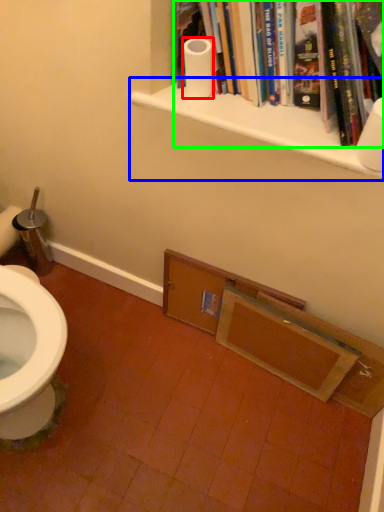
Question: Which object is positioned farthest from toilet paper (highlighted by a red box)? Select from shelf (highlighted by a blue box) and book (highlighted by a green box).

Choices:
 (A) shelf
 (B) book

Answer: (B)